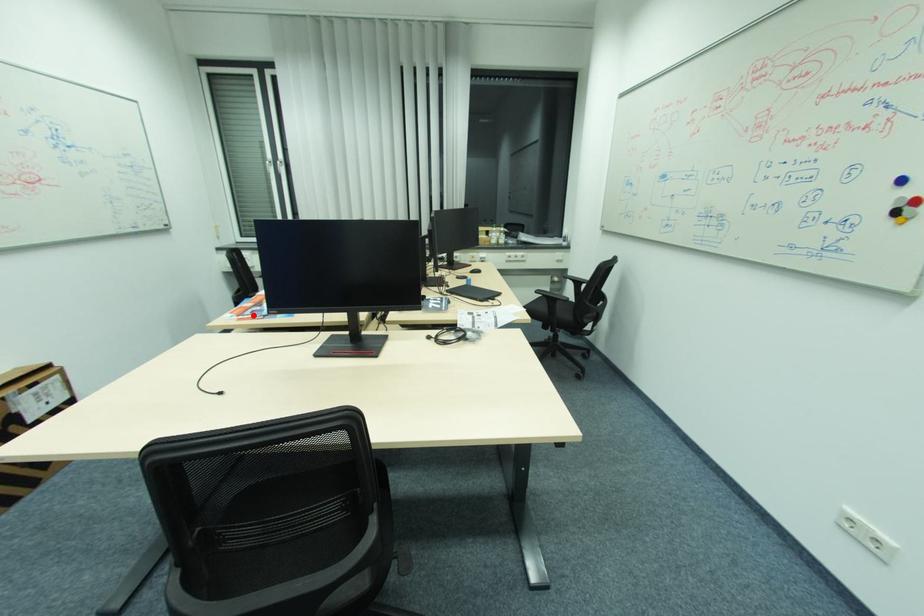
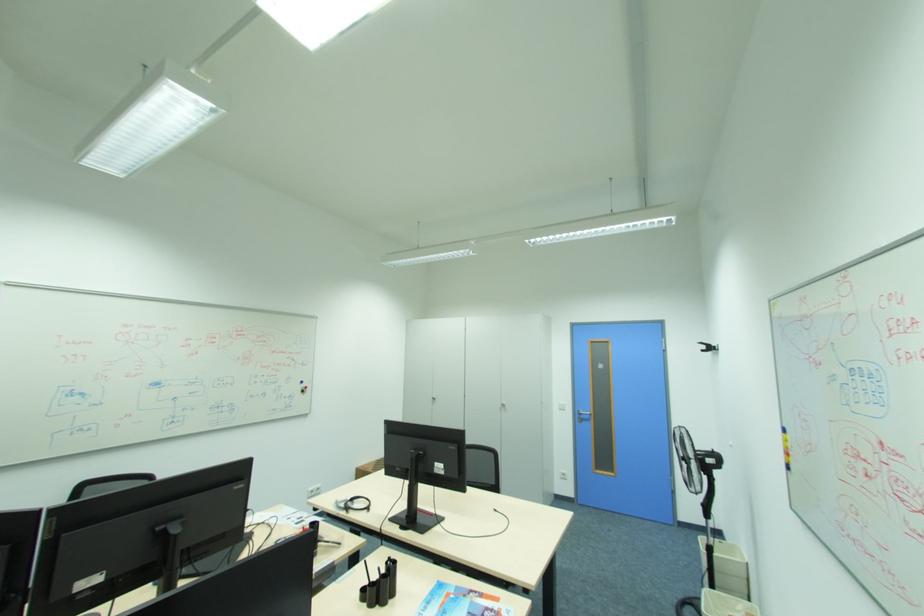
In the second image, find the point that corresponds to the highlighted location in the first image.

(492, 610)